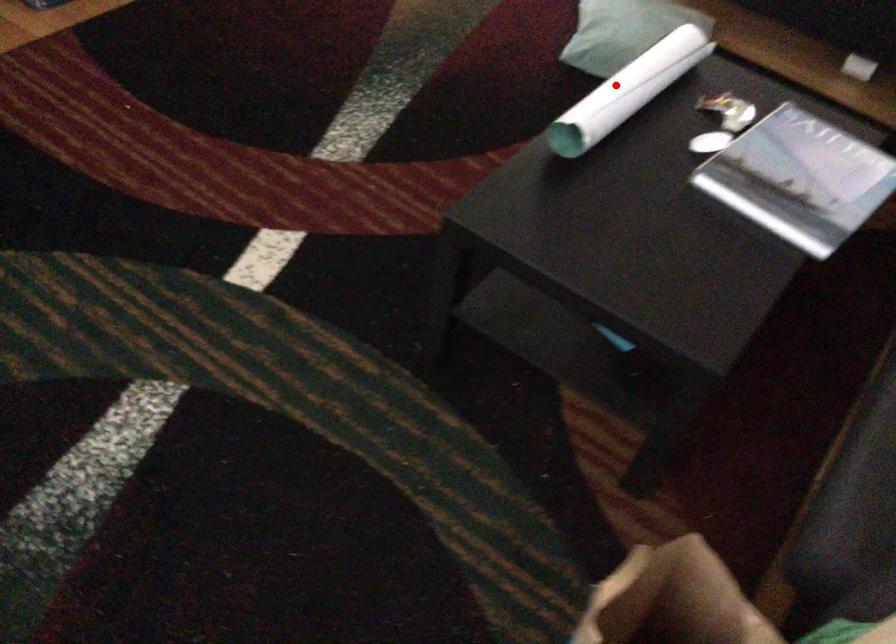
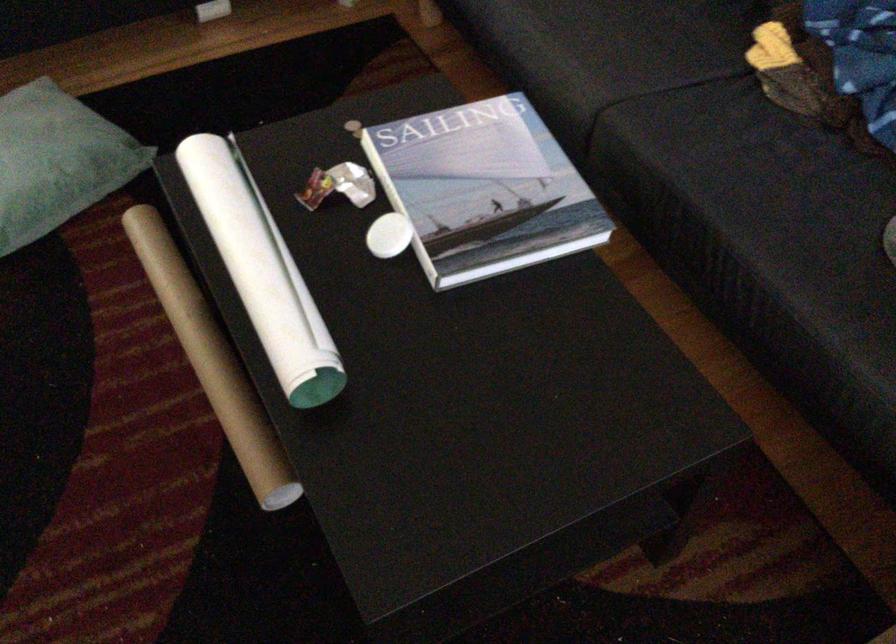
Question: I am providing you with two images of the same scene from different viewpoints. Given a red point in image1, look at the same physical point in image2. Is it:

Choices:
 (A) Closer to the viewpoint
 (B) Farther from the viewpoint

Answer: (A)